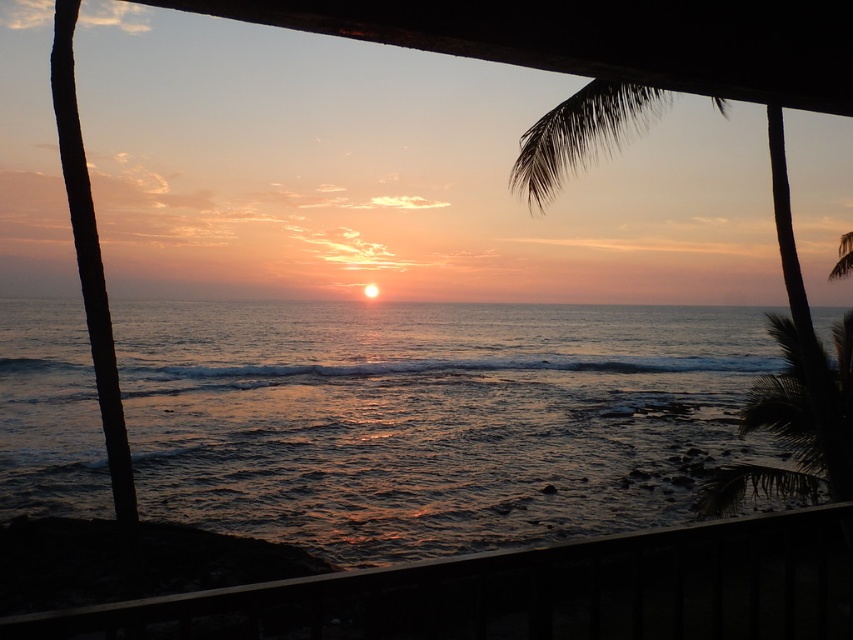
Between shiny blue water at center and green leafy palm tree at upper right, which one appears on the left side from the viewer's perspective?

shiny blue water at center is more to the left.

Describe the element at coordinates (431, 419) in the screenshot. This screenshot has height=640, width=853. I see `shiny blue water at center` at that location.

This screenshot has height=640, width=853. I want to click on shiny blue water at center, so click(x=431, y=419).

You are a GUI agent. You are given a task and a screenshot of the screen. Output one action in this format:
    pyautogui.click(x=<x>, y=<y>)
    Task: Click on the shiny blue water at center
    The image size is (853, 640).
    Given the screenshot: What is the action you would take?
    pyautogui.click(x=431, y=419)

Between shiny blue water at center and smooth wooden railing at lower center, which one is positioned higher?

shiny blue water at center is higher up.

Find the location of a particular element. Image resolution: width=853 pixels, height=640 pixels. shiny blue water at center is located at coordinates (431, 419).

Is smooth wooden railing at lower center to the right of green leafy palm tree at upper right from the viewer's perspective?

No, smooth wooden railing at lower center is not to the right of green leafy palm tree at upper right.

Is smooth wooden railing at lower center positioned behind green leafy palm tree at upper right?

No, smooth wooden railing at lower center is in front of green leafy palm tree at upper right.

Describe the element at coordinates (531, 593) in the screenshot. The height and width of the screenshot is (640, 853). I see `smooth wooden railing at lower center` at that location.

Identify the location of smooth wooden railing at lower center. This screenshot has width=853, height=640. (531, 593).